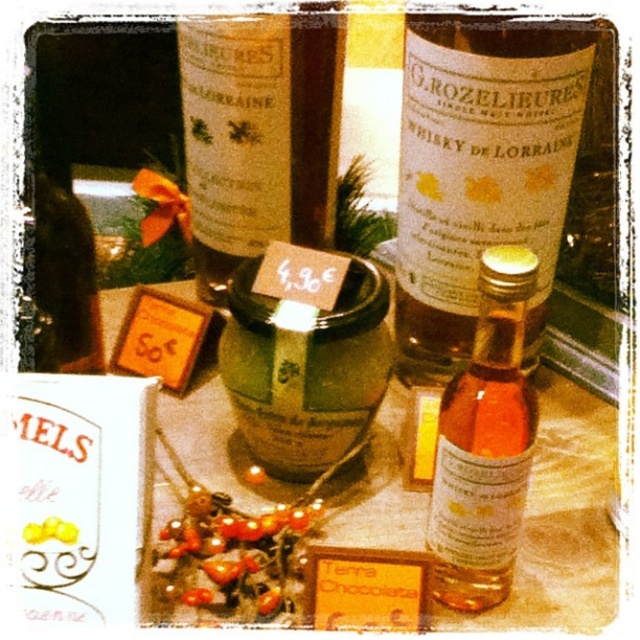
You are a delivery person who needs to place a fragile item between the translucent glass jar at center and the matte glass bottle at center. The item requires at least 6 inches of space to be safely placed. Can you fit it there?

The distance between the translucent glass jar at center and the matte glass bottle at center is only 5.77 inches, which is less than the required 6 inches. Therefore, the fragile item cannot be safely placed between them.

You are a customer at a market stall and want to pick up the translucent glass jar at center and the matte glass bottle at center. Which one do you need to move first to access the other?

You need to move the translucent glass jar at center first because it is in front of the matte glass bottle at center, so moving it will allow access to the one behind.

You are a customer looking to buy both the translucent glass jar at center and the matte glass bottle at center. You want to pick them up to examine them closely. Which one should you pick up first to avoid knocking over the other?

You should pick up the translucent glass jar at center first, as it is positioned under the matte glass bottle at center. Lifting the lower one first will prevent disturbing the bottle above it.